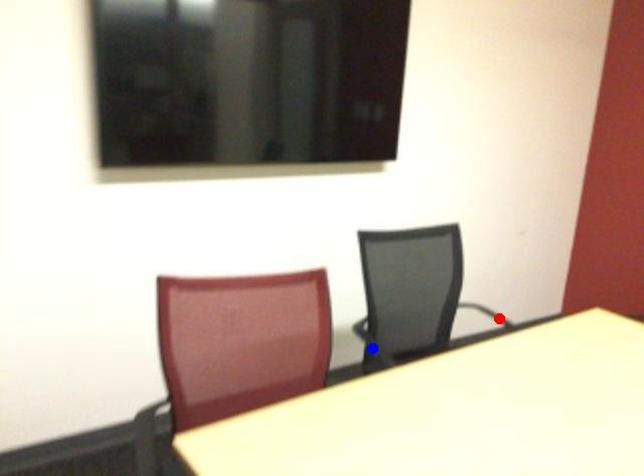
Question: Which of the two points in the image is closer to the camera?

Choices:
 (A) Blue point is closer.
 (B) Red point is closer.

Answer: (A)